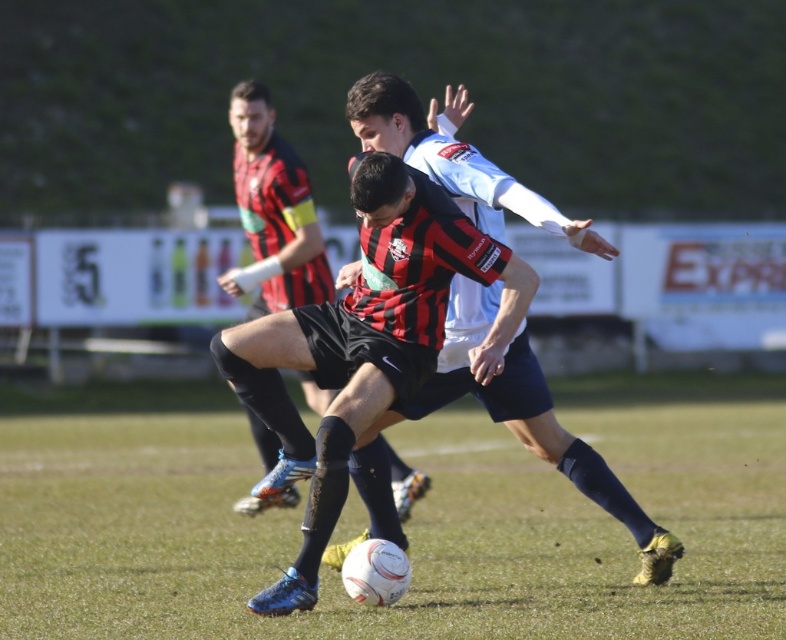
Question: Among these points, which one is farthest from the camera?

Choices:
 (A) (496, 232)
 (B) (274, 442)
 (C) (147, 552)

Answer: (B)

Question: Which object appears farthest from the camera in this image?

Choices:
 (A) black and red striped jersey at center
 (B) matte black shorts at center

Answer: (B)

Question: Which of the following is the farthest from the observer?

Choices:
 (A) black and red striped jersey at center
 (B) matte black shorts at center
 (C) green grass at center

Answer: (B)

Question: Considering the relative positions of black and red striped jersey at center and matte black shorts at center in the image provided, where is black and red striped jersey at center located with respect to matte black shorts at center?

Choices:
 (A) right
 (B) left

Answer: (A)

Question: Is black and red striped jersey at center bigger than matte black shorts at center?

Choices:
 (A) no
 (B) yes

Answer: (B)

Question: Can you confirm if green grass at center is bigger than black and red striped jersey at center?

Choices:
 (A) yes
 (B) no

Answer: (A)